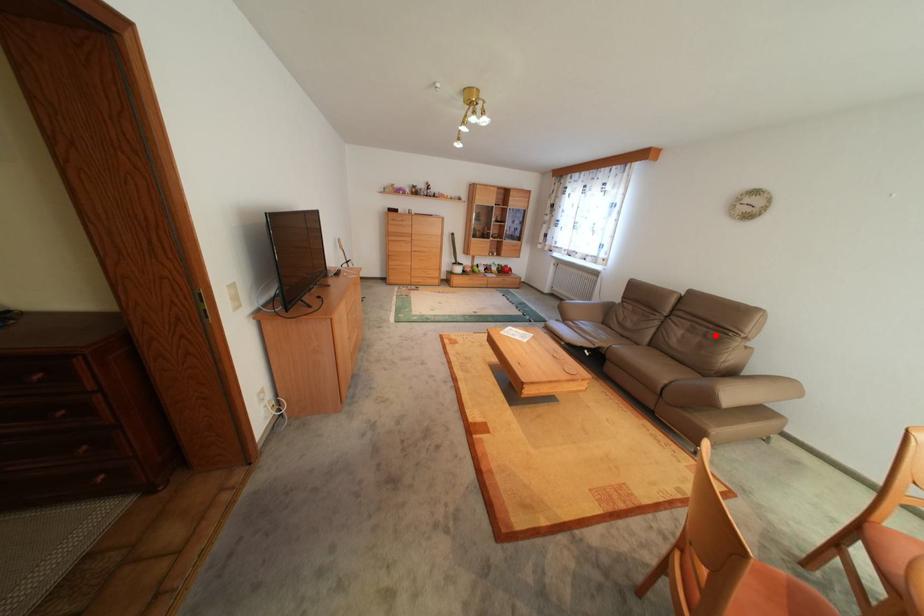
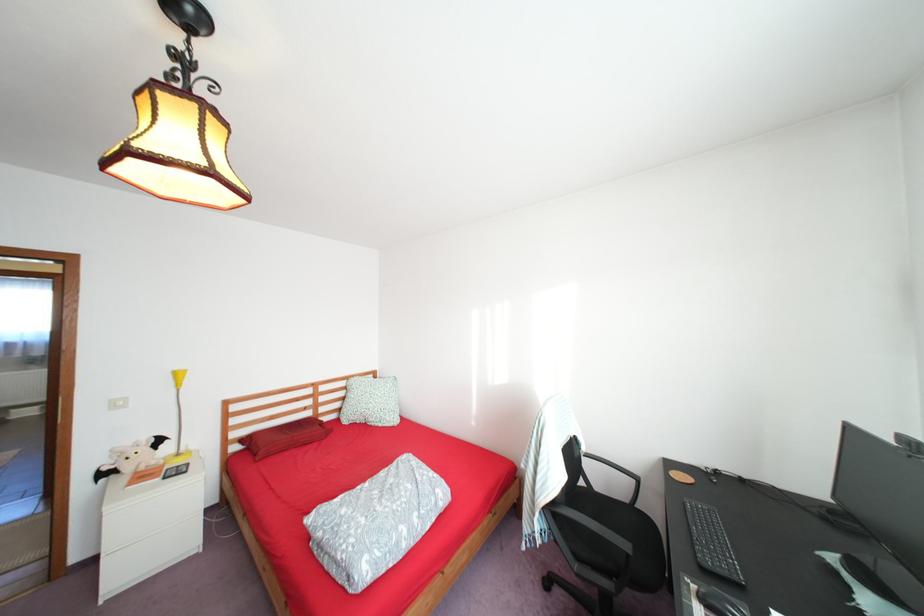
Question: I am providing you with two images of the same scene from different viewpoints. A red point is marked on the first image. At the location where the point appears in image 1, is it still visible in image 2?

Choices:
 (A) Yes
 (B) No

Answer: (B)